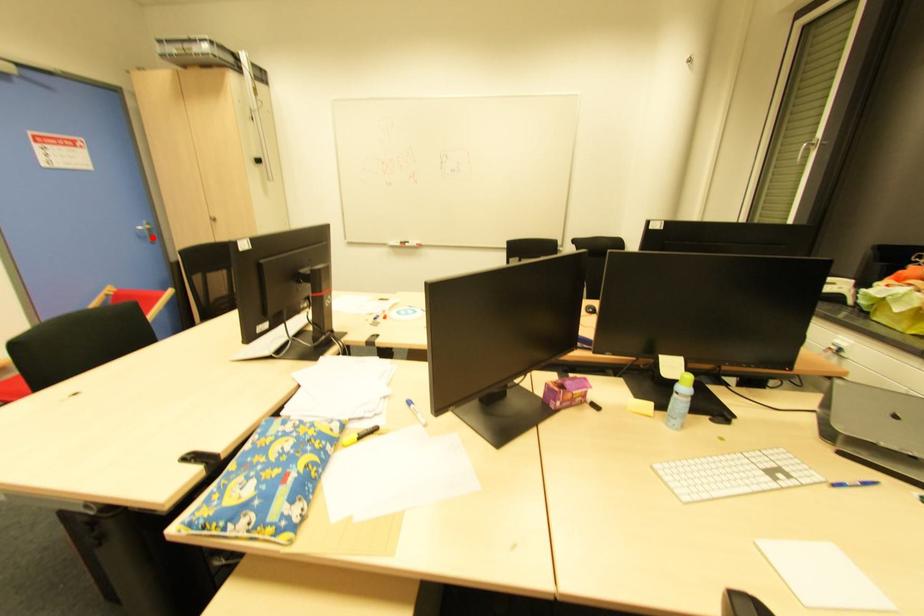
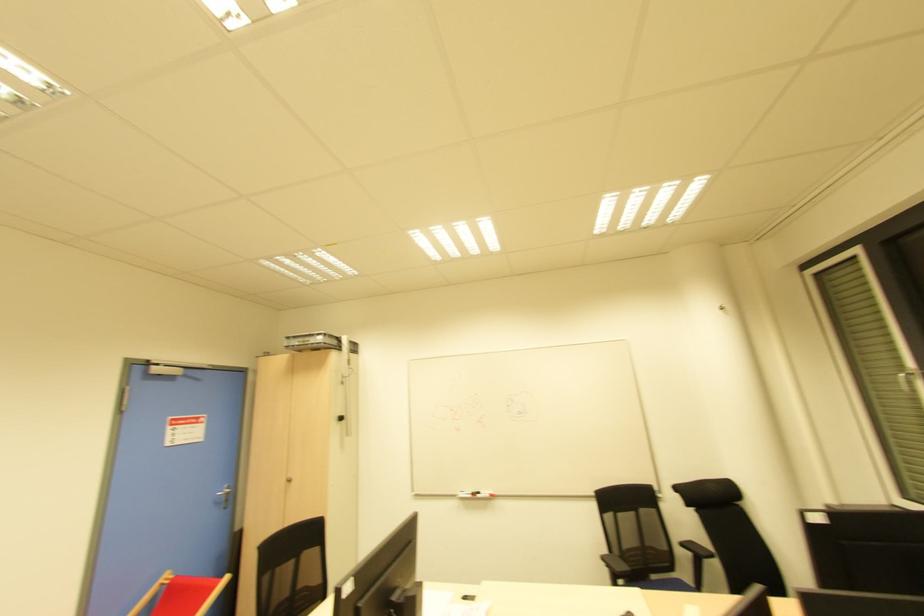
Find the pixel in the second image that matches the highlighted location in the first image.

(225, 501)